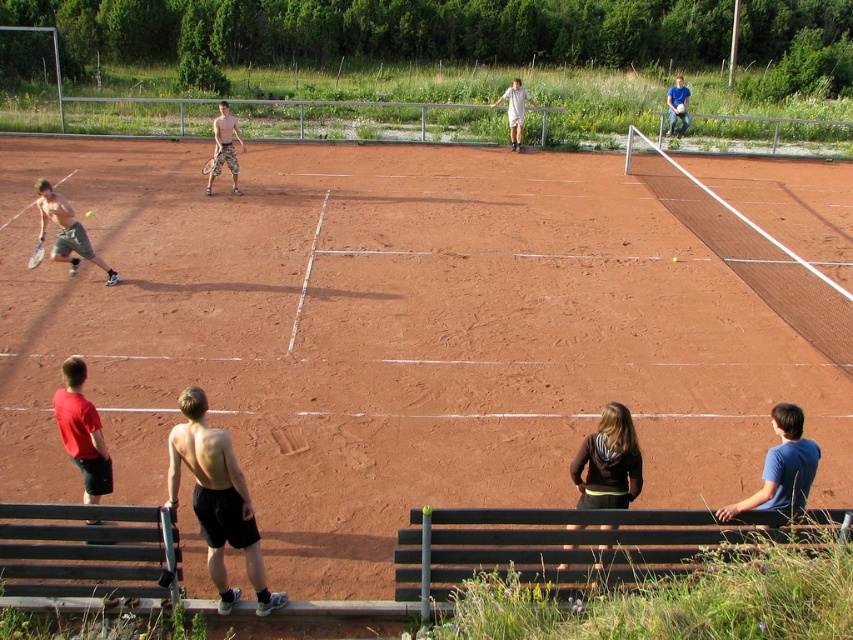
You are a photographer trying to capture a closeup of the black matte shorts at center and the white cotton shirt at center. Since you want both items to be clearly visible in the photo, which one should you zoom in on more?

The black matte shorts at center occupies less space than the white cotton shirt at center, so you should zoom in more on the black matte shorts at center to ensure it is clearly visible alongside the larger white cotton shirt at center.

You are a photographer positioned at the bottom edge of the tennis court. You want to take a photo of the black matte shorts at center. Where should you aim your camera relative to the court?

The black matte shorts at center are located at the coordinates 0.783 on the x axis and 0.256 on the y axis, so you should aim your camera towards the upper right direction from your current position at the bottom edge.